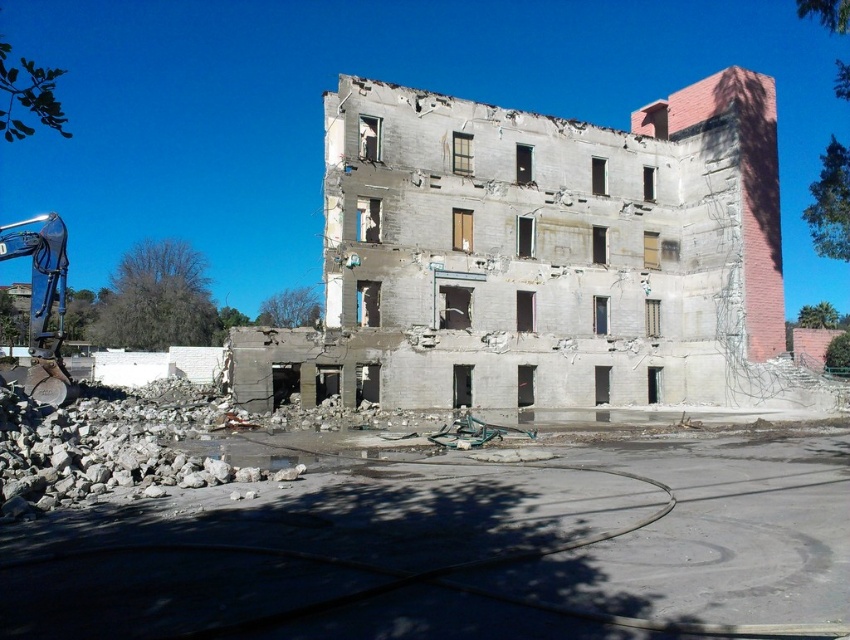
Question: Is crumbled concrete debris at lower left further to the viewer compared to metallic blue excavator arm at left?

Choices:
 (A) yes
 (B) no

Answer: (B)

Question: Among these objects, which one is farthest from the camera?

Choices:
 (A) crumbled concrete debris at lower left
 (B) metallic blue excavator arm at left

Answer: (B)

Question: Which object appears closest to the camera in this image?

Choices:
 (A) metallic blue excavator arm at left
 (B) crumbled concrete debris at lower left

Answer: (B)

Question: Which point is closer to the camera taking this photo?

Choices:
 (A) (160, 612)
 (B) (44, 342)

Answer: (A)

Question: Does crumbled concrete debris at lower left appear under metallic blue excavator arm at left?

Choices:
 (A) yes
 (B) no

Answer: (A)

Question: Can you confirm if crumbled concrete debris at lower left is positioned to the right of metallic blue excavator arm at left?

Choices:
 (A) yes
 (B) no

Answer: (A)